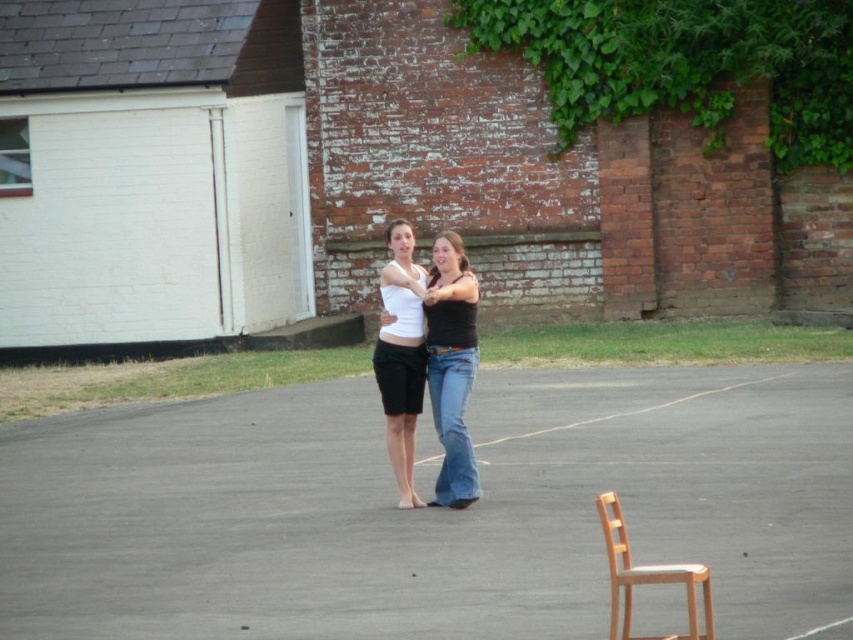
Is matte black shorts at center smaller than white matte shorts at center?

Incorrect, matte black shorts at center is not smaller in size than white matte shorts at center.

Between point (453, 396) and point (421, 292), which one is positioned in front?

Point (421, 292) is in front.

Locate an element on the screen. matte black shorts at center is located at coordinates (450, 362).

Between matte black shorts at center and light brown wooden chair at lower right, which one has less height?

Standing shorter between the two is light brown wooden chair at lower right.

Does matte black shorts at center have a greater width compared to light brown wooden chair at lower right?

Yes, matte black shorts at center is wider than light brown wooden chair at lower right.

Who is more distant from viewer, (445,464) or (695,611)?

The point (445,464) is behind.

In order to click on matte black shorts at center in this screenshot , I will do `click(450, 362)`.

Between point (401, 460) and point (691, 605), which one is positioned in front?

Point (691, 605) is in front.

Can you confirm if white matte shorts at center is wider than light brown wooden chair at lower right?

In fact, white matte shorts at center might be narrower than light brown wooden chair at lower right.

Is point (374, 356) closer to viewer compared to point (693, 621)?

No, it is behind (693, 621).

Identify the location of white matte shorts at center. (401, 355).